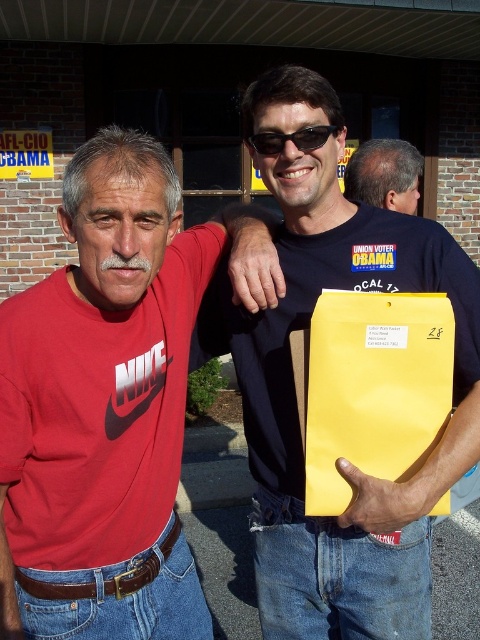
Can you confirm if gray hair at upper center is positioned to the left of black plastic sunglasses at center?

No, gray hair at upper center is not to the left of black plastic sunglasses at center.

How far apart are gray hair at upper center and black plastic sunglasses at center?

gray hair at upper center is 1.34 meters from black plastic sunglasses at center.

Which is in front, point (380, 138) or point (310, 131)?

Point (310, 131)

Identify the location of gray hair at upper center. click(384, 173).

Between matte black shirt at center and black plastic sunglasses at center, which one appears on the left side from the viewer's perspective?

black plastic sunglasses at center is more to the left.

Between point (278, 355) and point (264, 147), which one is positioned in front?

Point (264, 147) is more forward.

Locate an element on the screen. The width and height of the screenshot is (480, 640). matte black shirt at center is located at coordinates (295, 394).

Locate an element on the screen. The width and height of the screenshot is (480, 640). matte black shirt at center is located at coordinates (295, 394).

Is matte red t-shirt at left below gray hair at upper center?

Yes, matte red t-shirt at left is below gray hair at upper center.

Between point (87, 195) and point (381, 152), which one is positioned in front?

Point (87, 195)

At what (x,y) coordinates should I click in order to perform the action: click on matte red t-shirt at left. Please return your answer as a coordinate pair (x, y). Looking at the image, I should click on (103, 406).